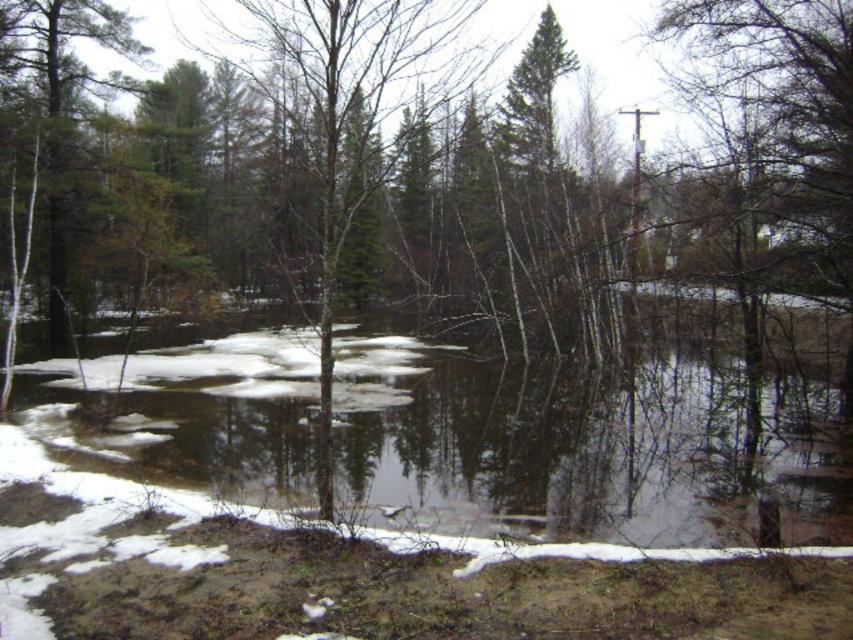
You are standing in the winter landscape scene and want to walk from point A to point B. Point A is at coordinate point(x=160, y=376) and point B is at coordinate point(x=258, y=20). Since you can only move towards the camera, will you be able to reach point B from point A?

Point(x=160, y=376) is further to the camera than point(x=258, y=20). Since you can only move towards the camera, you can move from point A to point B because point B is closer to the camera than point A.